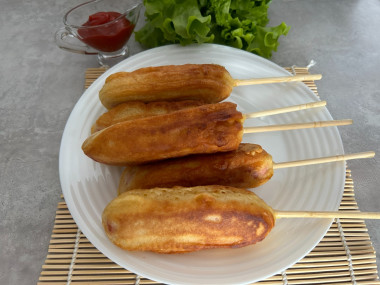
Image resolution: width=380 pixels, height=285 pixels. What are the coordinates of `glass cup with ketchu[` in the screenshot? It's located at (110, 30).